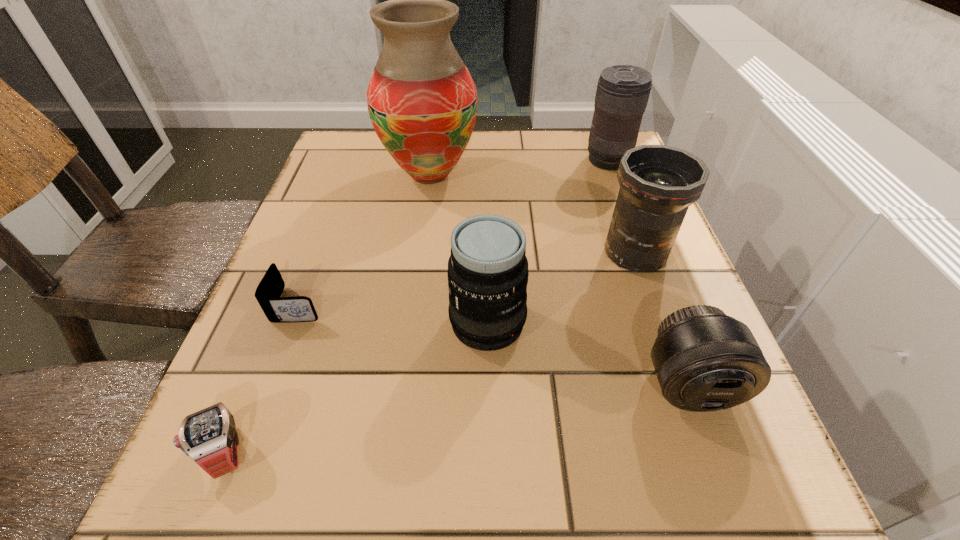
In the image, there is a desktop. Identify the location of free region at the near right corner. This screenshot has height=540, width=960. (678, 478).

Where is `free point between the fifth nearest object and the third shortest object`? The height and width of the screenshot is (540, 960). free point between the fifth nearest object and the third shortest object is located at coordinates (661, 319).

The image size is (960, 540). I want to click on free space between the third farthest object and the fifth tallest object, so click(x=661, y=319).

Find the location of a particular element. The width and height of the screenshot is (960, 540). empty location between the tallest object and the farthest telephoto lens is located at coordinates (518, 167).

The height and width of the screenshot is (540, 960). Find the location of `free spot between the shortest object and the watch`. free spot between the shortest object and the watch is located at coordinates (263, 377).

Identify the location of free spot between the farthest telephoto lens and the watch. (417, 306).

Locate an element on the screen. free space between the wallet and the vase is located at coordinates pos(365,239).

Select which object appears as the third closest to the wallet. Please provide its 2D coordinates. Your answer should be formatted as a tuple, i.e. [(x, y)], where the tuple contains the x and y coordinates of a point satisfying the conditions above.

[(422, 101)]

Point out which object is positioned as the fifth nearest to the vase. Please provide its 2D coordinates. Your answer should be formatted as a tuple, i.e. [(x, y)], where the tuple contains the x and y coordinates of a point satisfying the conditions above.

[(704, 360)]

Identify which telephoto lens is the fourth nearest to the tallest object. Please provide its 2D coordinates. Your answer should be formatted as a tuple, i.e. [(x, y)], where the tuple contains the x and y coordinates of a point satisfying the conditions above.

[(704, 360)]